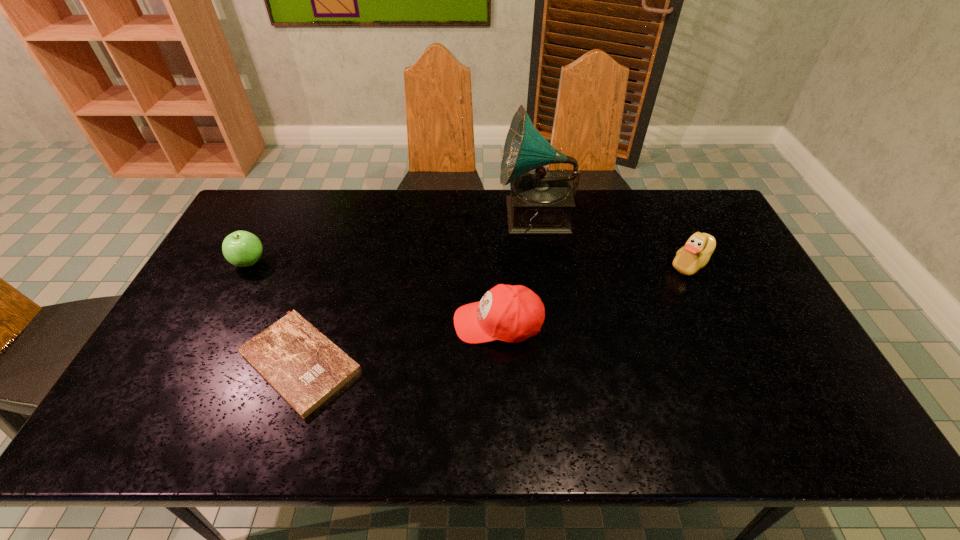
This screenshot has width=960, height=540. What are the coordinates of `record player` in the screenshot? It's located at (540, 202).

Find the location of `the tallest object`. the tallest object is located at coordinates (540, 202).

In order to click on the rightmost object in this screenshot , I will do `click(696, 253)`.

I want to click on baseball cap, so click(508, 313).

Where is `the leftmost object`? Image resolution: width=960 pixels, height=540 pixels. the leftmost object is located at coordinates (241, 248).

The width and height of the screenshot is (960, 540). Find the location of `Bible`. Bible is located at coordinates (306, 368).

The image size is (960, 540). I want to click on the shortest object, so click(306, 368).

Find the location of `vacant space located on the horn of the record player`. vacant space located on the horn of the record player is located at coordinates (412, 219).

The height and width of the screenshot is (540, 960). I want to click on vacant space located on the horn of the record player, so click(406, 219).

Locate an element on the screen. vacant space located on the horn of the record player is located at coordinates (481, 219).